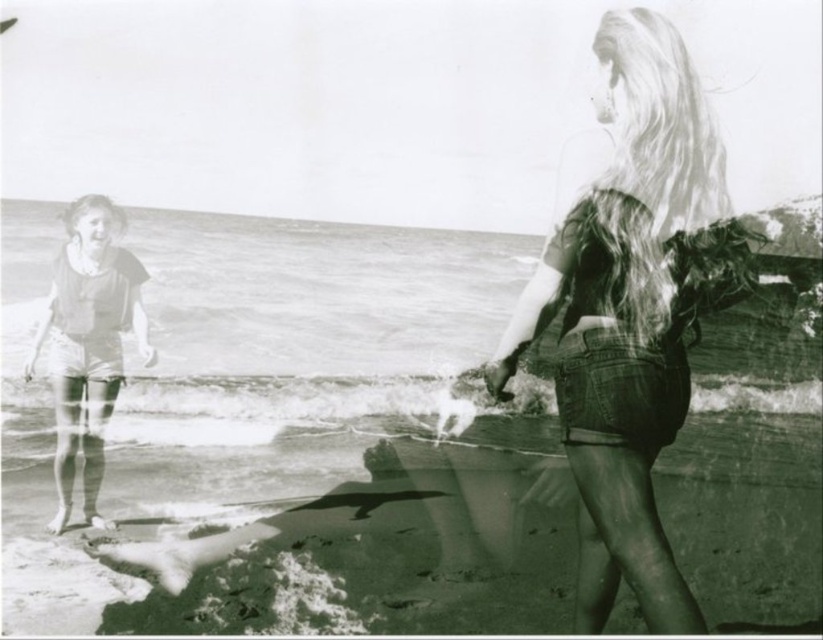
Can you confirm if smooth sand at lower center is positioned to the left of denim shorts at center?

Indeed, smooth sand at lower center is positioned on the left side of denim shorts at center.

Which is more to the left, smooth sand at lower center or denim shorts at center?

smooth sand at lower center is more to the left.

Which is in front, point (487, 452) or point (670, 584)?

Point (670, 584) is more forward.

Locate an element on the screen. smooth sand at lower center is located at coordinates (379, 548).

Who is more distant from viewer, (68, 593) or (42, 324)?

The point (42, 324) is behind.

Which of these two, smooth sand at lower center or matte fabric swimsuit at left, stands shorter?

smooth sand at lower center is shorter.

Identify the location of smooth sand at lower center. (379, 548).

In the scene shown: Between denim shorts at center and matte fabric swimsuit at left, which one is positioned lower?

matte fabric swimsuit at left

Does denim shorts at center appear over matte fabric swimsuit at left?

Yes, denim shorts at center is above matte fabric swimsuit at left.

Between point (649, 493) and point (75, 317), which one is positioned in front?

Positioned in front is point (649, 493).

Identify the location of denim shorts at center. The image size is (823, 640). (631, 310).